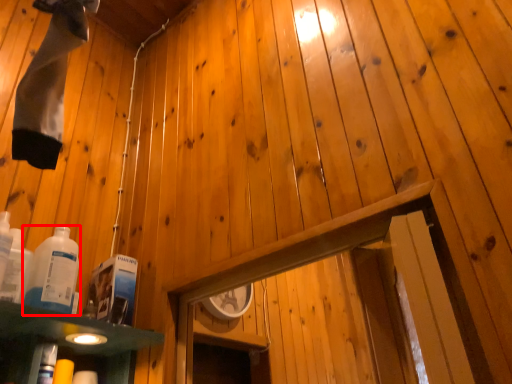
Question: Where is bottle (annotated by the red box) located in relation to bottle in the image?

Choices:
 (A) left
 (B) right

Answer: (B)